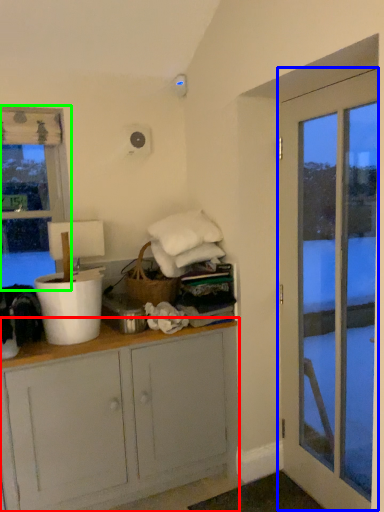
Question: Which is farther away from cabinetry (highlighted by a red box)? door (highlighted by a blue box) or window (highlighted by a green box)?

Choices:
 (A) door
 (B) window

Answer: (B)